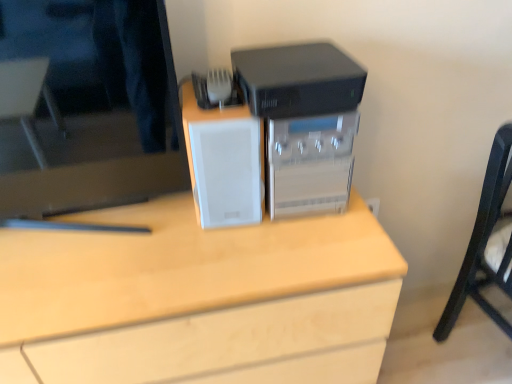
Question: Is sleek plastic printer at center further to the viewer compared to white matte speaker at center?

Choices:
 (A) yes
 (B) no

Answer: (A)

Question: From a real-world perspective, does sleek plastic printer at center sit lower than white matte speaker at center?

Choices:
 (A) yes
 (B) no

Answer: (A)

Question: Does sleek plastic printer at center come in front of white matte speaker at center?

Choices:
 (A) yes
 (B) no

Answer: (B)

Question: From the image's perspective, is sleek plastic printer at center over white matte speaker at center?

Choices:
 (A) no
 (B) yes

Answer: (B)

Question: Is white matte speaker at center at the back of sleek plastic printer at center?

Choices:
 (A) yes
 (B) no

Answer: (B)

Question: Is sleek plastic printer at center wider than white matte speaker at center?

Choices:
 (A) yes
 (B) no

Answer: (A)

Question: From a real-world perspective, is matte black monitor at upper left under sleek plastic printer at center?

Choices:
 (A) no
 (B) yes

Answer: (A)

Question: Could sleek plastic printer at center be considered to be inside matte black monitor at upper left?

Choices:
 (A) no
 (B) yes

Answer: (A)

Question: Is matte black monitor at upper left not close to sleek plastic printer at center?

Choices:
 (A) no
 (B) yes

Answer: (A)

Question: From the image's perspective, is matte black monitor at upper left located above sleek plastic printer at center?

Choices:
 (A) yes
 (B) no

Answer: (A)

Question: Is matte black monitor at upper left positioned with its back to sleek plastic printer at center?

Choices:
 (A) yes
 (B) no

Answer: (B)

Question: Does matte black monitor at upper left have a greater width compared to sleek plastic printer at center?

Choices:
 (A) yes
 (B) no

Answer: (B)

Question: From a real-world perspective, is white matte desk at center on white matte speaker at center?

Choices:
 (A) yes
 (B) no

Answer: (B)